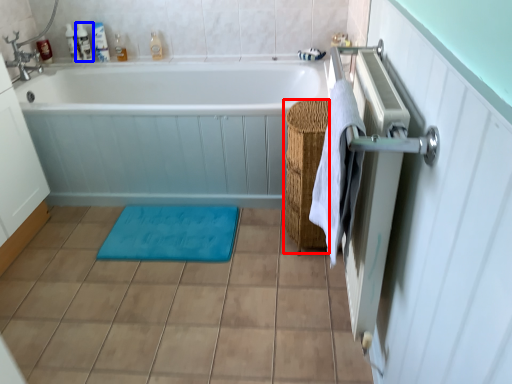
Question: Which object is further to the camera taking this photo, basket (highlighted by a red box) or toiletry (highlighted by a blue box)?

Choices:
 (A) basket
 (B) toiletry

Answer: (B)